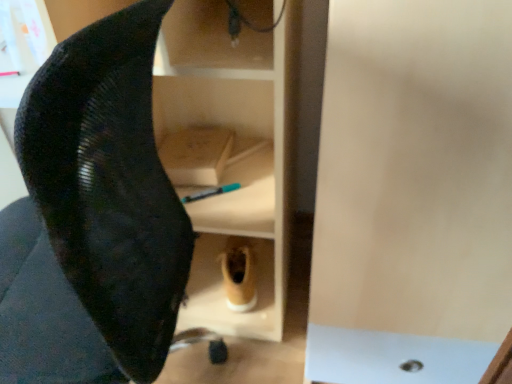
This screenshot has height=384, width=512. Describe the element at coordinates (239, 275) in the screenshot. I see `tan suede boot at lower center` at that location.

You are a GUI agent. You are given a task and a screenshot of the screen. Output one action in this format:
    pyautogui.click(x=<x>, y=<y>)
    Task: Click on the tan suede boot at lower center
    The image size is (512, 384).
    Given the screenshot: What is the action you would take?
    [239, 275]

At what (x,y) coordinates should I click in order to perform the action: click on black mesh swivel chair at left. Please return your answer as a coordinate pair (x, y). This screenshot has height=384, width=512. Looking at the image, I should click on (95, 216).

This screenshot has height=384, width=512. What do you see at coordinates (95, 216) in the screenshot?
I see `black mesh swivel chair at left` at bounding box center [95, 216].

At what (x,y) coordinates should I click in order to perform the action: click on tan suede boot at lower center. Please return your answer as a coordinate pair (x, y). Looking at the image, I should click on (239, 275).

Can you confirm if black mesh swivel chair at left is positioned to the left of tan suede boot at lower center?

Indeed, black mesh swivel chair at left is positioned on the left side of tan suede boot at lower center.

Does black mesh swivel chair at left lie behind tan suede boot at lower center?

No, black mesh swivel chair at left is closer to the viewer.

Which point is more forward, (74, 354) or (245, 261)?

Point (74, 354)

From the image's perspective, is black mesh swivel chair at left positioned above or below tan suede boot at lower center?

black mesh swivel chair at left is above tan suede boot at lower center.

From a real-world perspective, is black mesh swivel chair at left on tan suede boot at lower center?

Yes.

Between black mesh swivel chair at left and tan suede boot at lower center, which one has smaller width?

tan suede boot at lower center is thinner.

Who is shorter, black mesh swivel chair at left or tan suede boot at lower center?

Standing shorter between the two is tan suede boot at lower center.

Considering the relative sizes of black mesh swivel chair at left and tan suede boot at lower center in the image provided, is black mesh swivel chair at left smaller than tan suede boot at lower center?

Actually, black mesh swivel chair at left might be larger than tan suede boot at lower center.

Is black mesh swivel chair at left situated inside tan suede boot at lower center or outside?

black mesh swivel chair at left is located beyond the bounds of tan suede boot at lower center.

Is there a large distance between black mesh swivel chair at left and tan suede boot at lower center?

black mesh swivel chair at left is near tan suede boot at lower center, not far away.

Is black mesh swivel chair at left looking in the opposite direction of tan suede boot at lower center?

black mesh swivel chair at left does not have its back to tan suede boot at lower center.

How different are the orientations of black mesh swivel chair at left and tan suede boot at lower center in degrees?

100 degrees separate the facing orientations of black mesh swivel chair at left and tan suede boot at lower center.

Consider the image. How far apart are black mesh swivel chair at left and tan suede boot at lower center?

22.40 inches.

This screenshot has width=512, height=384. What are the coordinates of `footwear behind the black mesh swivel chair at left` in the screenshot? It's located at (239, 275).

In the image, is tan suede boot at lower center on the left side or the right side of black mesh swivel chair at left?

tan suede boot at lower center is positioned on black mesh swivel chair at left's right side.

Between tan suede boot at lower center and black mesh swivel chair at left, which one is positioned in front?

Positioned in front is black mesh swivel chair at left.

From the picture: Which is farther from the camera, [230,246] or [147,340]?

The point [230,246] is farther from the camera.

From the image's perspective, is tan suede boot at lower center below black mesh swivel chair at left?

Yes, from the image's perspective, tan suede boot at lower center is below black mesh swivel chair at left.

From a real-world perspective, who is located higher, tan suede boot at lower center or black mesh swivel chair at left?

In real-world perspective, black mesh swivel chair at left is above.

Considering the sizes of objects tan suede boot at lower center and black mesh swivel chair at left in the image provided, who is wider, tan suede boot at lower center or black mesh swivel chair at left?

Wider between the two is black mesh swivel chair at left.

Can you confirm if tan suede boot at lower center is shorter than black mesh swivel chair at left?

Indeed, tan suede boot at lower center has a lesser height compared to black mesh swivel chair at left.

Consider the image. Which of these two, tan suede boot at lower center or black mesh swivel chair at left, is smaller?

With smaller size is tan suede boot at lower center.

From the picture: Is black mesh swivel chair at left completely or partially inside tan suede boot at lower center?

No, tan suede boot at lower center does not contain black mesh swivel chair at left.

Is tan suede boot at lower center not close to black mesh swivel chair at left?

That's not correct — tan suede boot at lower center is a little close to black mesh swivel chair at left.

Is black mesh swivel chair at left at the back of tan suede boot at lower center?

No, tan suede boot at lower center is not facing the opposite direction of black mesh swivel chair at left.

Can you tell me how much tan suede boot at lower center and black mesh swivel chair at left differ in facing direction?

100 degrees separate the facing orientations of tan suede boot at lower center and black mesh swivel chair at left.

How far apart are tan suede boot at lower center and black mesh swivel chair at left?

tan suede boot at lower center and black mesh swivel chair at left are 22.40 inches apart from each other.

Identify the location of swivel chair that is above the tan suede boot at lower center (from the image's perspective). (95, 216).

Identify the location of swivel chair above the tan suede boot at lower center (from a real-world perspective). The image size is (512, 384). (95, 216).

Locate an element on the screen. swivel chair in front of the tan suede boot at lower center is located at coordinates (95, 216).